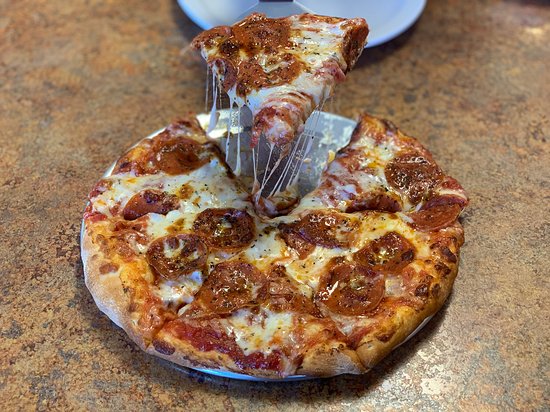
Locate an element on the screen. This screenshot has width=550, height=412. table in front of pizza is located at coordinates (265, 400).